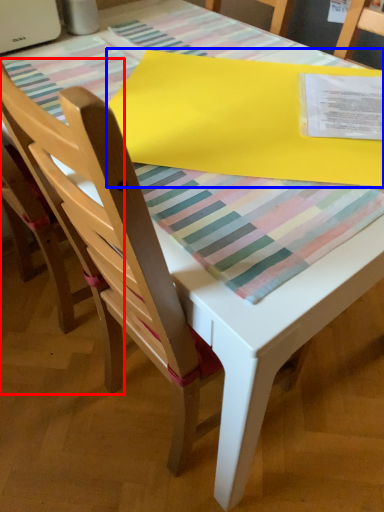
Question: Which object appears closest to the camera in this image, chair (highlighted by a red box) or blanket (highlighted by a blue box)?

Choices:
 (A) chair
 (B) blanket

Answer: (A)